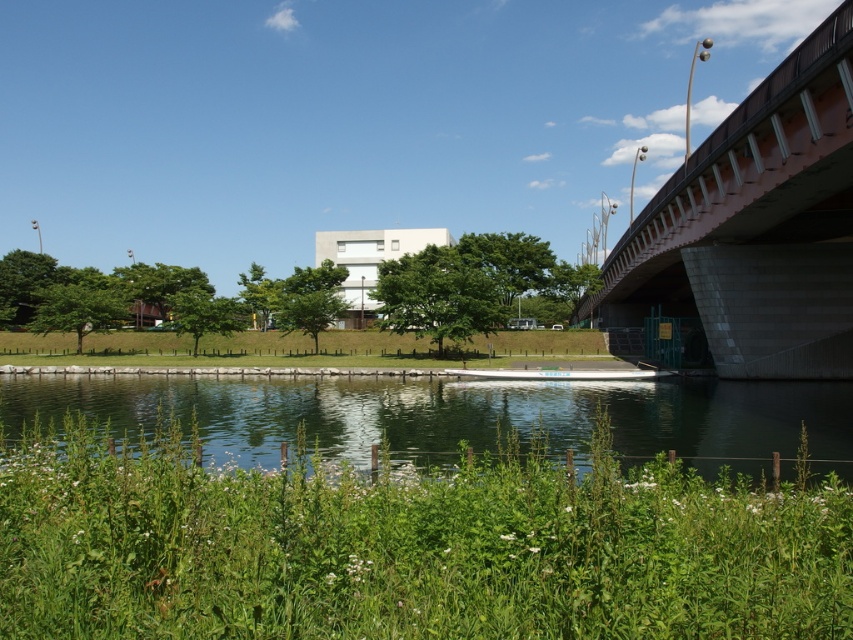
Question: Is concrete bridge at right to the right of green grass at center from the viewer's perspective?

Choices:
 (A) yes
 (B) no

Answer: (A)

Question: Among these points, which one is nearest to the camera?

Choices:
 (A) (271, 448)
 (B) (22, 348)
 (C) (831, 99)

Answer: (C)

Question: Does transparent water at center come in front of concrete bridge at right?

Choices:
 (A) no
 (B) yes

Answer: (B)

Question: In this image, where is transparent water at center located relative to concrete bridge at right?

Choices:
 (A) left
 (B) right

Answer: (A)

Question: Among these objects, which one is nearest to the camera?

Choices:
 (A) transparent water at center
 (B) concrete bridge at right

Answer: (A)

Question: Which of these objects is positioned closest to the green grass at center?

Choices:
 (A) concrete bridge at right
 (B) transparent water at center

Answer: (B)